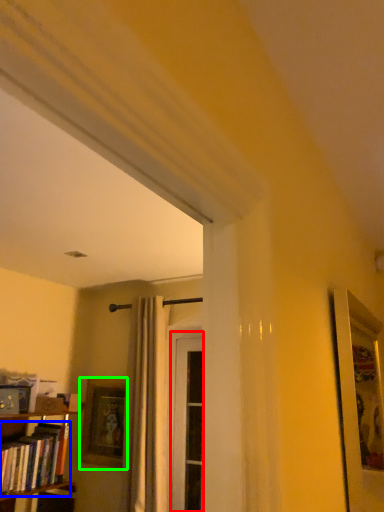
Question: Considering the real-world distances, which object is farthest from screen door (highlighted by a red box)? book (highlighted by a blue box) or picture frame (highlighted by a green box)?

Choices:
 (A) book
 (B) picture frame

Answer: (A)